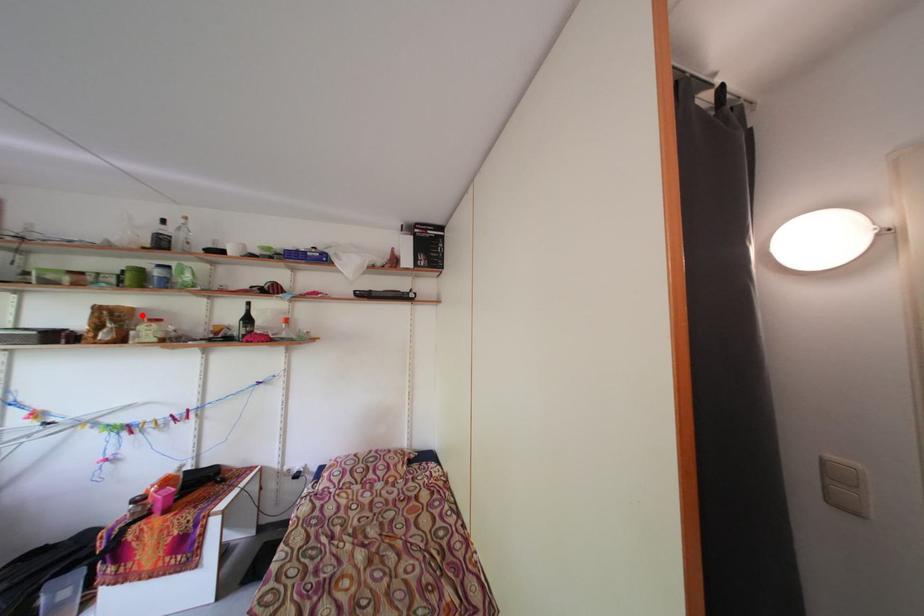
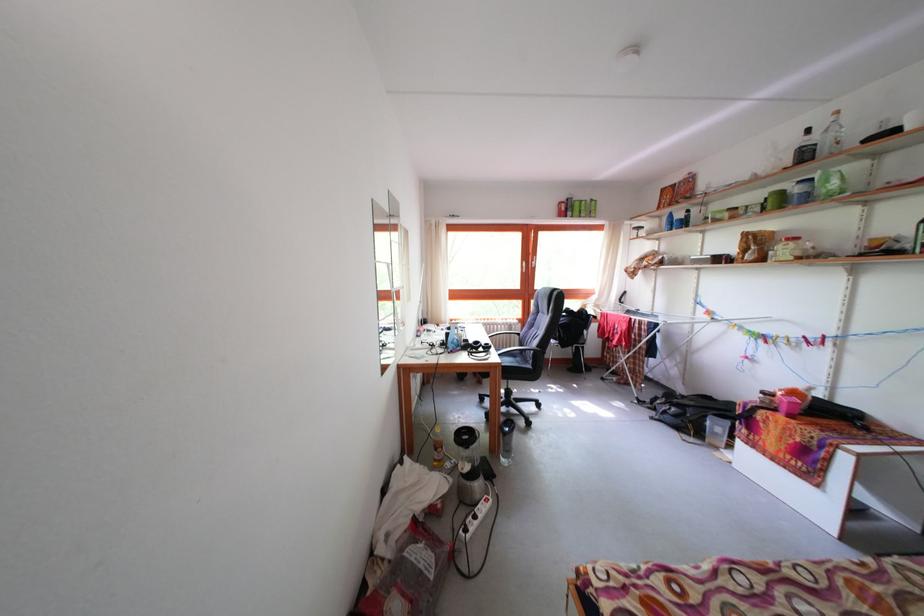
Where in the second image is the point corresponding to the highlighted location from the first image?

(783, 238)